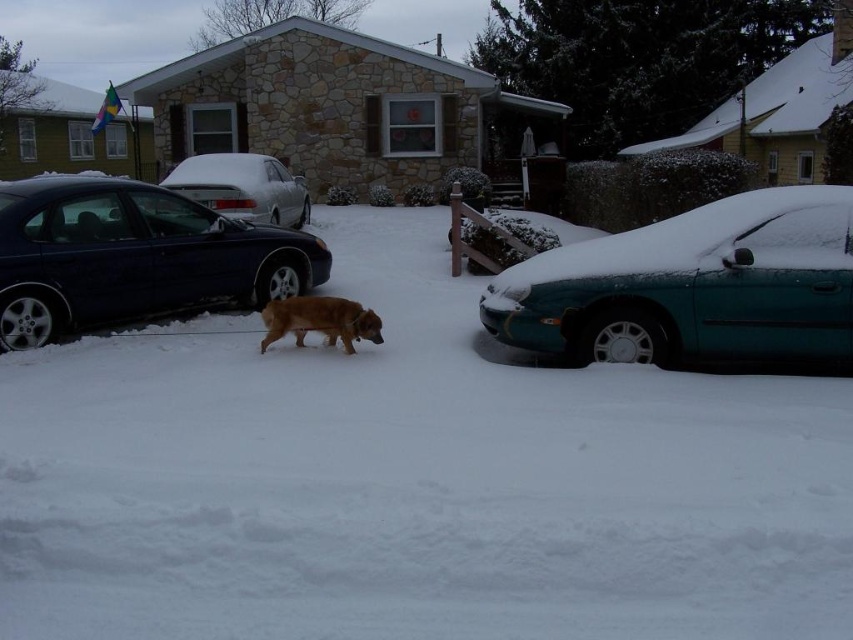
You are a delivery person trying to reach the front door of the house. The shiny blue sedan at left is blocking the path. Can you walk around the car to get to the fuzzy brown dog at center without stepping on the snow? Explain.

The distance between the shiny blue sedan at left and the fuzzy brown dog at center is 7.79 feet. Since the sedan is blocking the path, you can walk around it, but you need at least 3 feet of space to maneuver. Since 7.79 feet is more than enough, you can safely walk around the car without stepping on the snow.